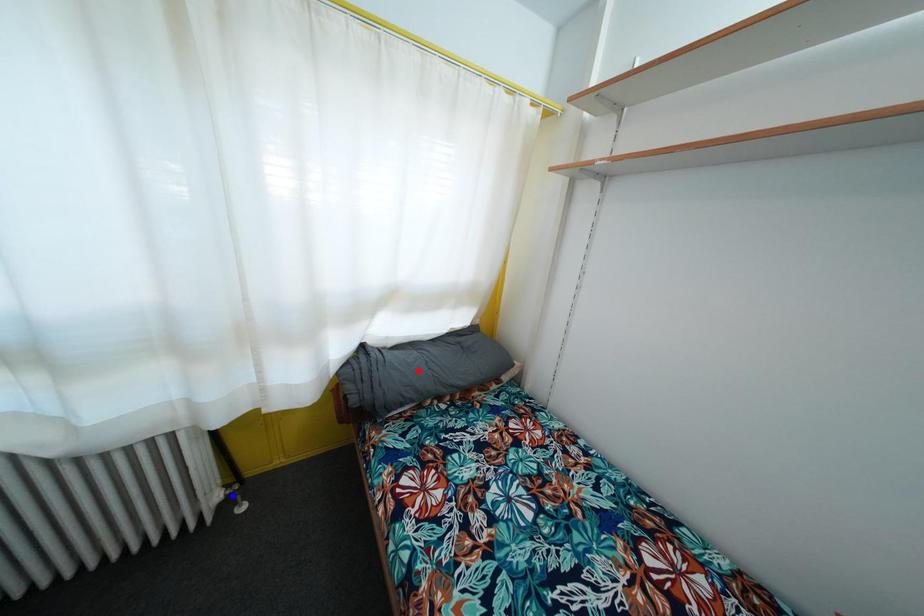
Question: In the image, two points are highlighted. Which point is nearer to the camera? Reply with the corresponding letter.

Choices:
 (A) blue point
 (B) red point

Answer: (A)